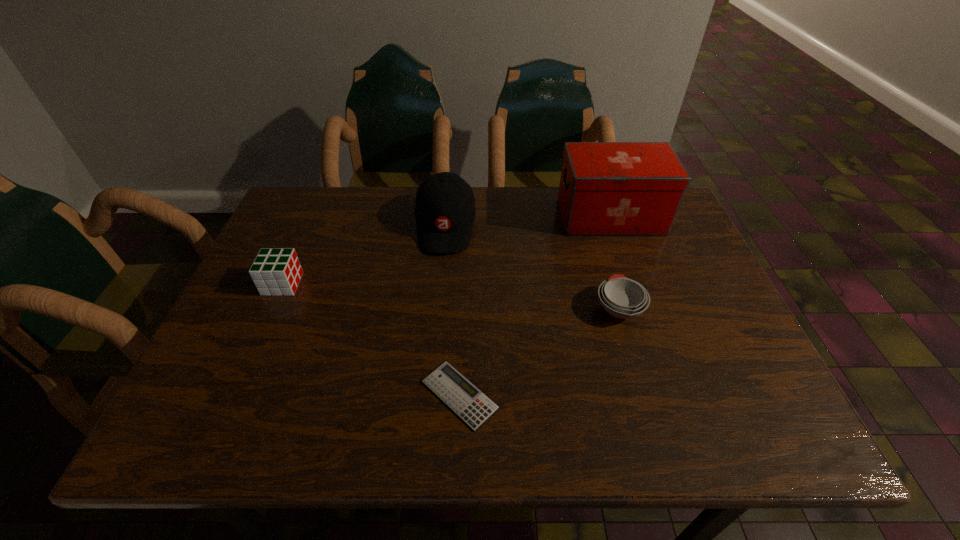
Where is `free space between the second shortest object and the tallest object`? The image size is (960, 540). free space between the second shortest object and the tallest object is located at coordinates 614,262.

I want to click on free point between the cube and the soup bowl, so click(x=450, y=296).

Where is `free space between the leftmost object and the soup bowl`? The image size is (960, 540). free space between the leftmost object and the soup bowl is located at coordinates (450, 296).

The height and width of the screenshot is (540, 960). What are the coordinates of `free spot between the shortest object and the tallest object` in the screenshot? It's located at (535, 306).

Identify the location of blank region between the soup bowl and the baseball cap. The height and width of the screenshot is (540, 960). (532, 267).

Select which object appears as the second closest to the third tallest object. Please provide its 2D coordinates. Your answer should be formatted as a tuple, i.e. [(x, y)], where the tuple contains the x and y coordinates of a point satisfying the conditions above.

[(469, 403)]

Point out which object is positioned as the third nearest to the calculator. Please provide its 2D coordinates. Your answer should be formatted as a tuple, i.e. [(x, y)], where the tuple contains the x and y coordinates of a point satisfying the conditions above.

[(277, 271)]

Find the location of a particular element. The width and height of the screenshot is (960, 540). blank space that satisfies the following two spatial constraints: 1. with a logo on the front of the second tallest object; 2. on the red face of the third tallest object is located at coordinates (441, 284).

Find the location of `vacant region that satisfies the following two spatial constraints: 1. on the red face of the cube; 2. on the right side of the second shortest object`. vacant region that satisfies the following two spatial constraints: 1. on the red face of the cube; 2. on the right side of the second shortest object is located at coordinates pyautogui.click(x=272, y=308).

Locate an element on the screen. This screenshot has width=960, height=540. free space that satisfies the following two spatial constraints: 1. on the back side of the soup bowl; 2. on the red face of the cube is located at coordinates (612, 284).